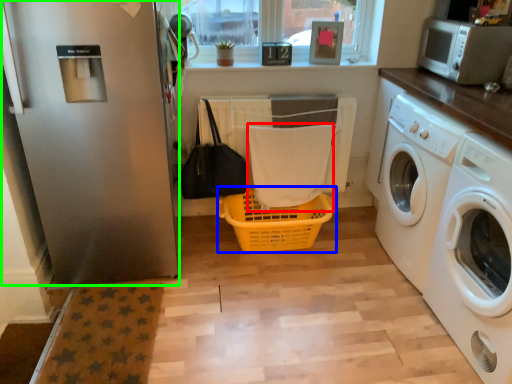
Question: Which object is the closest to the bath towel (highlighted by a red box)? Choose among these: basket (highlighted by a blue box) or screen door (highlighted by a green box).

Choices:
 (A) basket
 (B) screen door

Answer: (A)